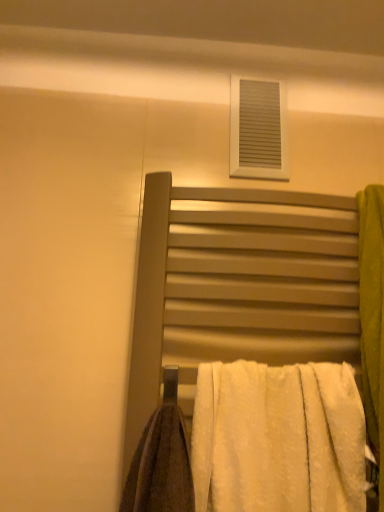
This screenshot has height=512, width=384. Find the location of `vacant point above matte metal towel rack at center (from a real-world perspective)`. vacant point above matte metal towel rack at center (from a real-world perspective) is located at coordinates 241,182.